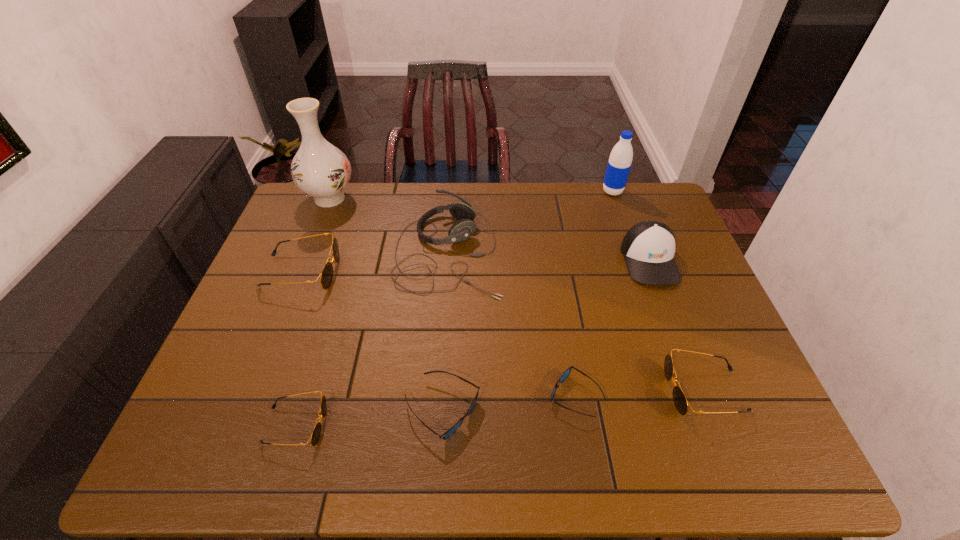
This screenshot has height=540, width=960. What are the coordinates of `free region at the far right corner` in the screenshot? It's located at (626, 202).

What are the coordinates of `vacant space at the near right corner` in the screenshot? It's located at coord(763,456).

Where is `vacant space in between the gray cap and the smallest black sunglasses`? Image resolution: width=960 pixels, height=540 pixels. vacant space in between the gray cap and the smallest black sunglasses is located at coordinates (472, 343).

Locate an element on the screen. This screenshot has width=960, height=540. vacant area between the second tallest sunglasses and the left blue sunglasses is located at coordinates (573, 401).

This screenshot has height=540, width=960. Identify the location of vacant area that lies between the tallest object and the second biggest black sunglasses. (516, 294).

Where is `blank region between the headset and the fourth object from right to left`? blank region between the headset and the fourth object from right to left is located at coordinates (512, 324).

This screenshot has width=960, height=540. Identify the location of vacant area that lies between the headset and the second biggest black sunglasses. (576, 321).

Where is `vacant area between the biggest black sunglasses and the second biggest black sunglasses`? This screenshot has height=540, width=960. vacant area between the biggest black sunglasses and the second biggest black sunglasses is located at coordinates (502, 331).

Locate an element on the screen. The height and width of the screenshot is (540, 960). free space between the gray cap and the left blue sunglasses is located at coordinates (546, 335).

Find the location of a particular element. Image resolution: width=960 pixels, height=540 pixels. free space between the smallest black sunglasses and the second tallest sunglasses is located at coordinates (500, 408).